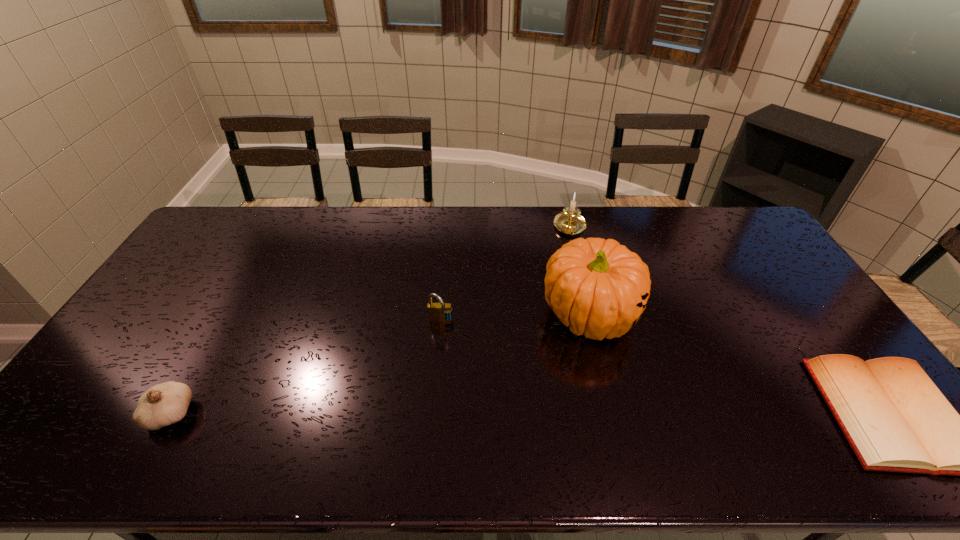
Locate an element on the screen. garlic is located at coordinates (164, 404).

In order to click on the second tallest object in this screenshot , I will do `click(570, 222)`.

I want to click on candle holder, so click(x=570, y=222).

Find the location of `pumpkin`. pumpkin is located at coordinates (596, 287).

Locate an element on the screen. The width and height of the screenshot is (960, 540). padlock is located at coordinates (437, 312).

Locate an element on the screen. vacant space located on the left of the garlic is located at coordinates click(x=111, y=414).

This screenshot has height=540, width=960. I want to click on vacant space situated 0.210m on the handle side of the farthest object, so click(x=575, y=281).

This screenshot has height=540, width=960. What are the coordinates of `vacant space located on the handle side of the farthest object` in the screenshot? It's located at (575, 273).

The width and height of the screenshot is (960, 540). What are the coordinates of `vacant space positioned 0.050m on the handle side of the farthest object` in the screenshot? It's located at (572, 250).

The height and width of the screenshot is (540, 960). I want to click on free space located 0.080m on the surface of the tallest object, so click(x=608, y=380).